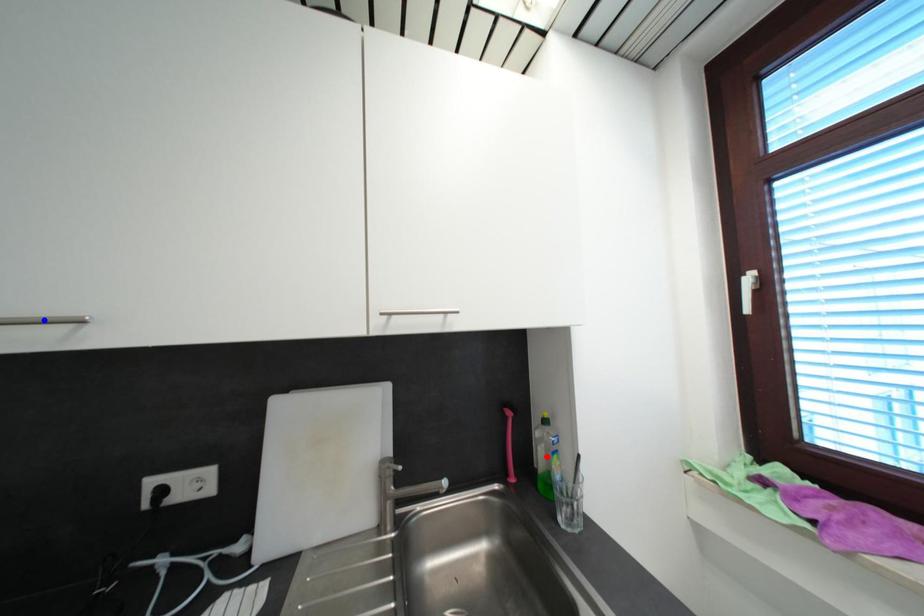
Question: Two points are marked on the image. Which point is closer to the camera?

Choices:
 (A) Blue point is closer.
 (B) Red point is closer.

Answer: (A)